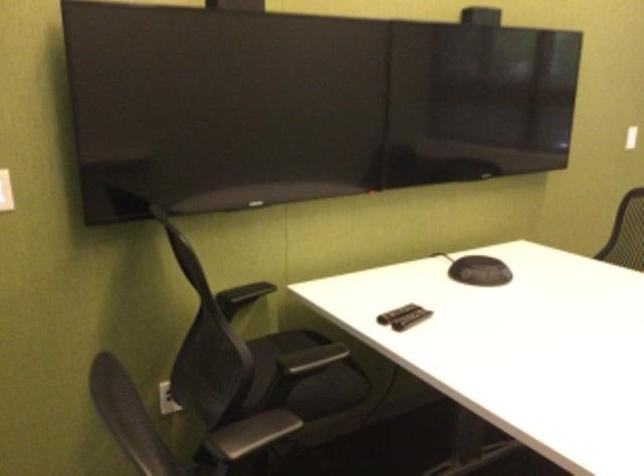
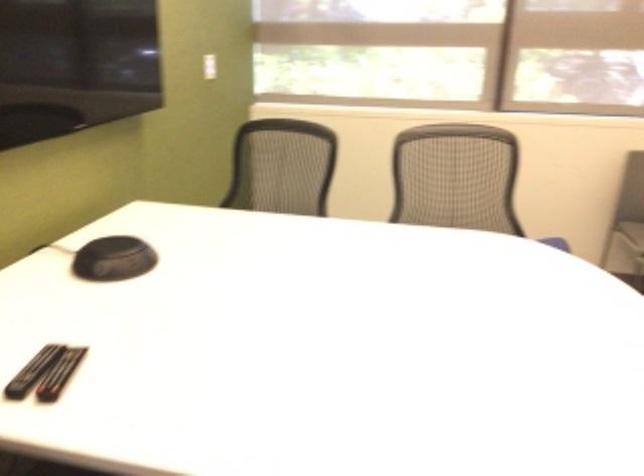
The point at (480, 268) is marked in the first image. Where is the corresponding point in the second image?

(113, 259)